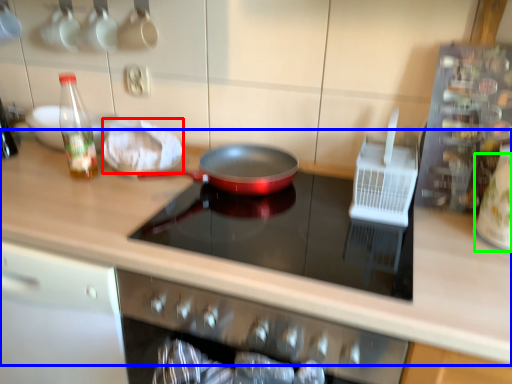
Question: Which object is positioned closest to food (highlighted by a red box)? Select from countertop (highlighted by a blue box) and appliance (highlighted by a green box).

Choices:
 (A) countertop
 (B) appliance

Answer: (A)